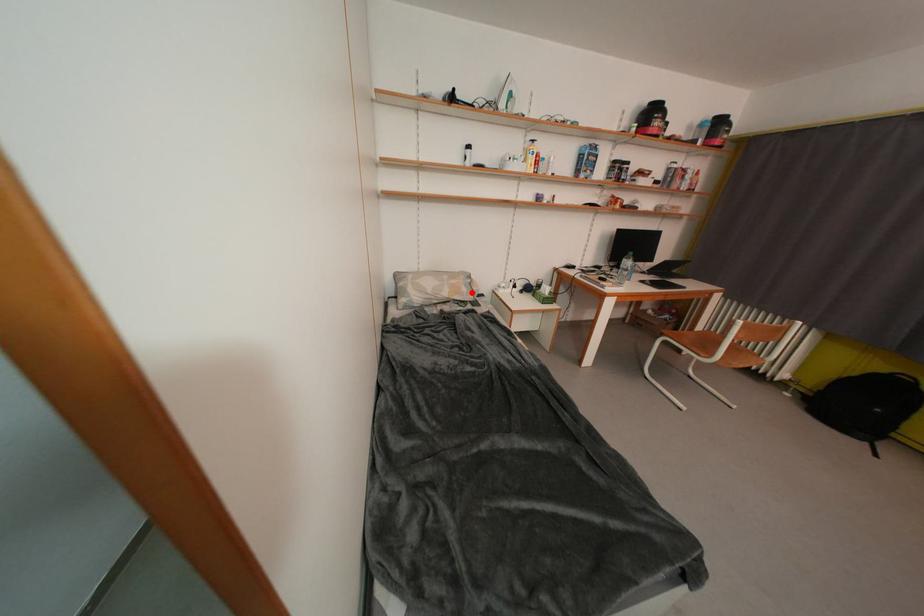
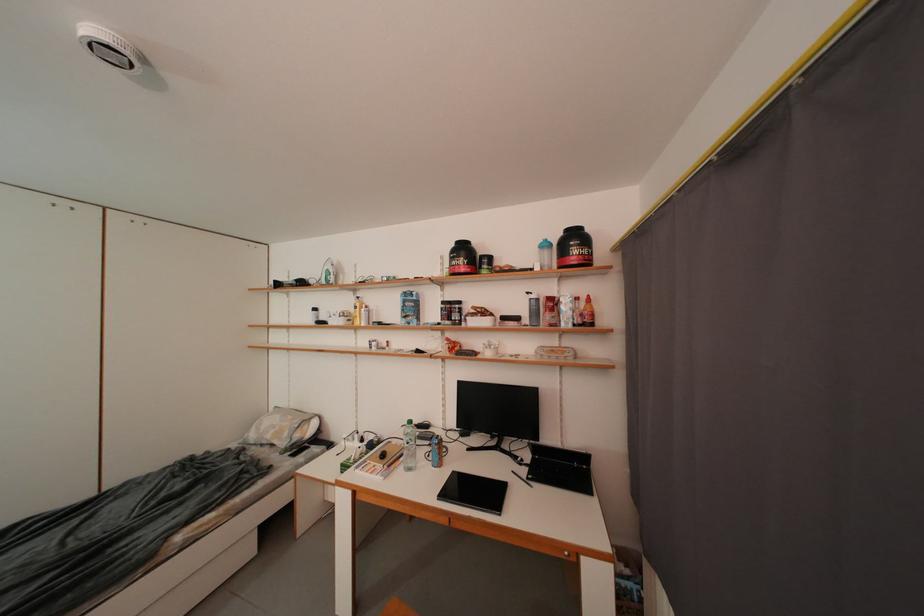
In the second image, find the point that corresponds to the highlighted location in the first image.

(294, 438)